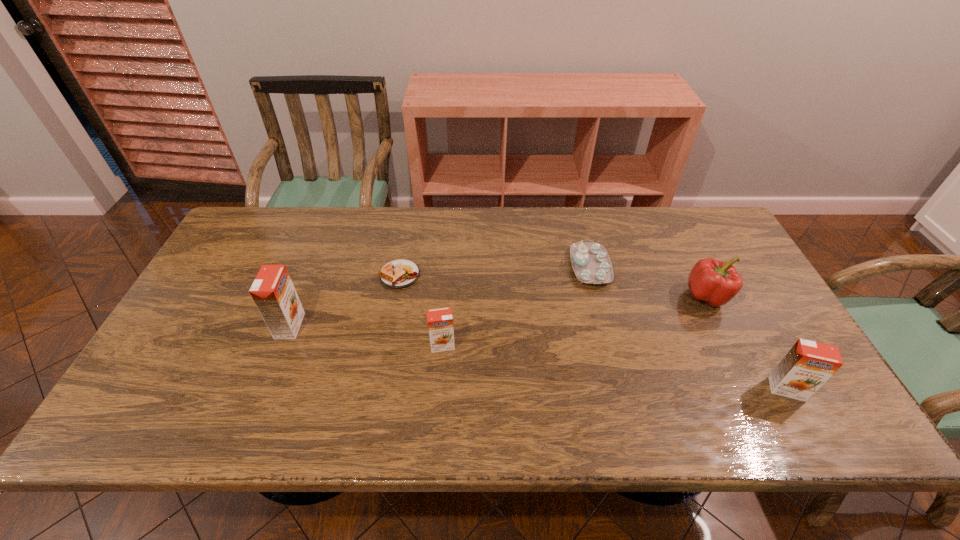
At what (x,y) coordinates should I click in order to perform the action: click on the tallest orange juice. Please return your answer as a coordinate pair (x, y). This screenshot has height=540, width=960. Looking at the image, I should click on (273, 292).

The image size is (960, 540). In order to click on the tallest object in this screenshot , I will do `click(273, 292)`.

Identify the location of the fourth object from right to left. The image size is (960, 540). (440, 321).

Locate an element on the screen. the second orange juice from right to left is located at coordinates (440, 321).

At what (x,y) coordinates should I click in order to perform the action: click on the nearest object. Please return your answer as a coordinate pair (x, y). The image size is (960, 540). Looking at the image, I should click on [807, 366].

You are a GUI agent. You are given a task and a screenshot of the screen. Output one action in this format:
    pyautogui.click(x=<x>, y=<y>)
    Task: Click on the nearest orange juice
    
    Given the screenshot: What is the action you would take?
    pyautogui.click(x=807, y=366)

Locate an element on the screen. The image size is (960, 540). the fourth object from left to right is located at coordinates (591, 263).

The height and width of the screenshot is (540, 960). Find the location of `the fifth tallest object`. the fifth tallest object is located at coordinates [x=591, y=263].

The height and width of the screenshot is (540, 960). Identify the location of bell pepper. (715, 282).

The width and height of the screenshot is (960, 540). What are the coordinates of `the shortest object` in the screenshot? It's located at (401, 273).